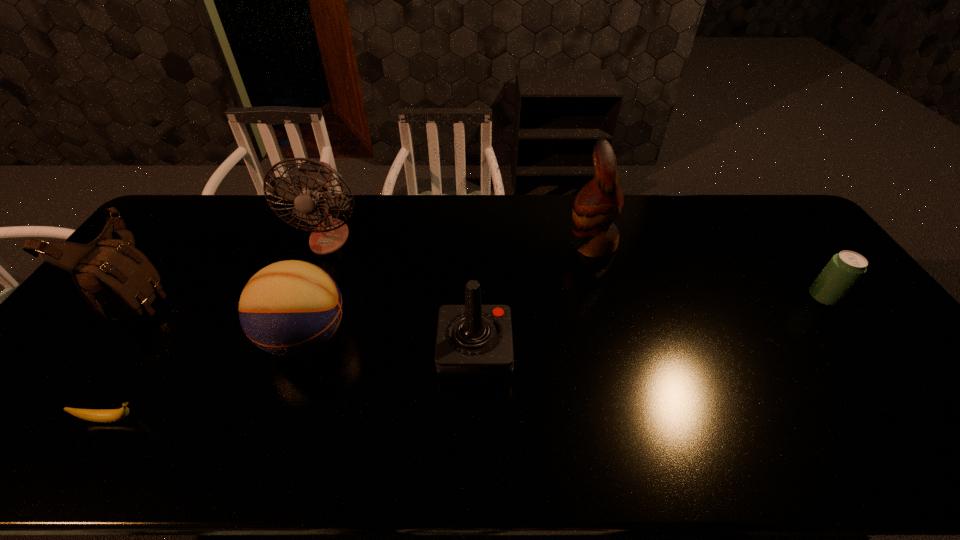
Locate an element on the screen. The image size is (960, 540). object present at the left edge is located at coordinates (118, 280).

I want to click on object that is at the right edge, so click(x=844, y=269).

You are a GUI agent. You are given a task and a screenshot of the screen. Output one action in this format:
    pyautogui.click(x=<x>, y=<y>)
    Task: Click on the free point at the far edge
    Image resolution: width=960 pixels, height=540 pixels.
    Given the screenshot: What is the action you would take?
    pyautogui.click(x=404, y=220)

Locate an element on the screen. This screenshot has width=960, height=540. vacant region at the near edge of the desktop is located at coordinates (362, 463).

Identify the location of free spot at the left edge of the desktop. (111, 353).

Locate an element on the screen. The image size is (960, 540). blank area at the right edge is located at coordinates coord(780,237).

Find the location of a particular element. vacant space at the far left corner is located at coordinates (213, 206).

Where is `free region at the far right corner`? free region at the far right corner is located at coordinates (777, 208).

I want to click on free spot between the fifth object from left to right and the basketball, so click(x=391, y=345).

Identify the location of free spot between the second shortest object and the third object from right to left. (649, 325).